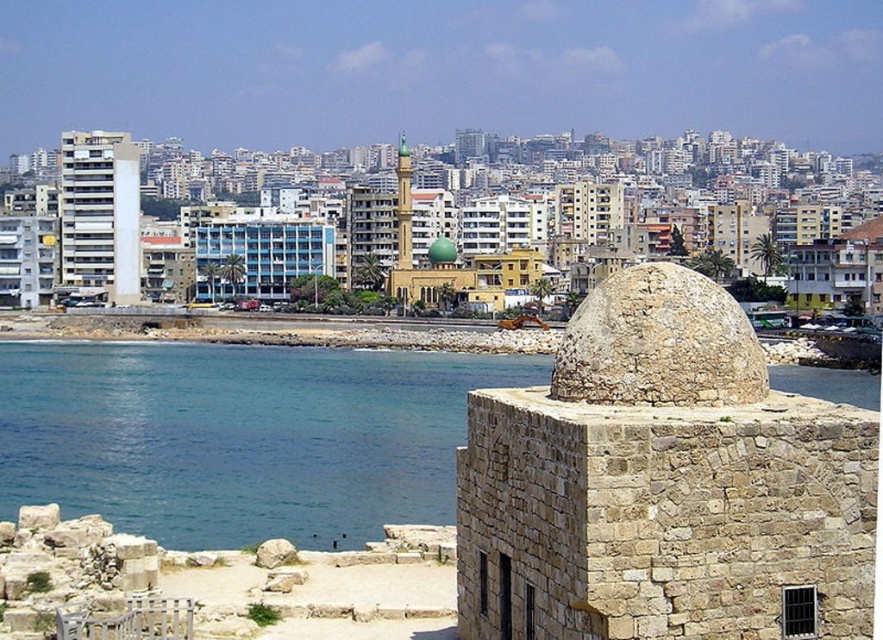
Question: Which of the following is the closest to the observer?

Choices:
 (A) (776, 416)
 (B) (306, 385)
 (C) (112, 237)

Answer: (A)

Question: Which of the following is the farthest from the observer?

Choices:
 (A) (289, 561)
 (B) (117, 248)
 (C) (263, 376)
 (D) (738, 525)

Answer: (B)

Question: Can you confirm if brown stone dome at center is thinner than white smooth building at left?

Choices:
 (A) no
 (B) yes

Answer: (B)

Question: Can you confirm if blue water at lower left is positioned below smooth gray rock at lower left?

Choices:
 (A) no
 (B) yes

Answer: (A)

Question: Is white smooth building at left closer to the viewer compared to smooth gray rock at lower left?

Choices:
 (A) no
 (B) yes

Answer: (A)

Question: Among these objects, which one is nearest to the camera?

Choices:
 (A) brown stone dome at center
 (B) white smooth building at left

Answer: (A)